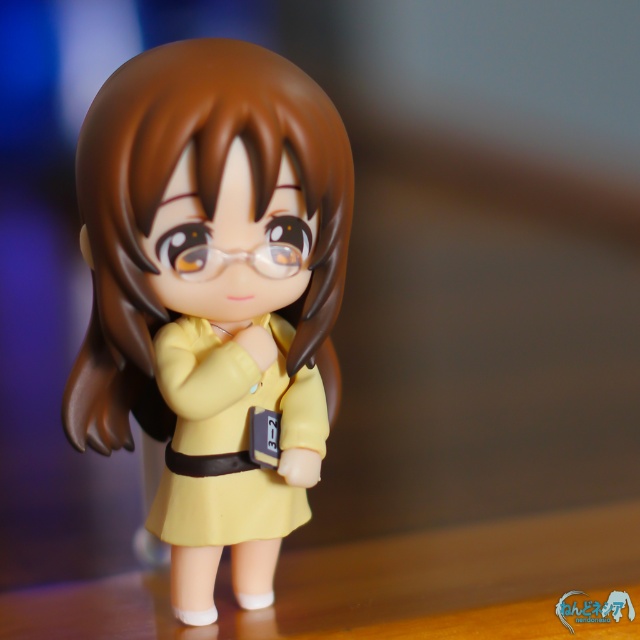
In the image of the anime figurine, there are two objects labeled as the matte yellow dress at center and the yellow matte dress at center. Which one is positioned to the left?

The matte yellow dress at center is positioned to the left of the yellow matte dress at center.